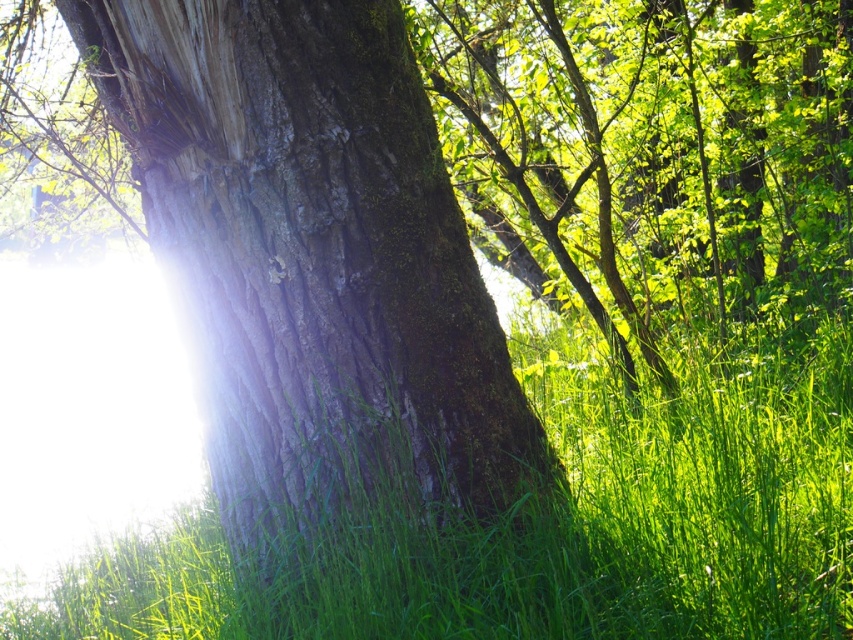
Looking at this image, does smooth bark tree trunk at center lie behind green grass at center?

Yes, it is.

Is smooth bark tree trunk at center positioned before green grass at center?

No, smooth bark tree trunk at center is further to the viewer.

Measure the distance between smooth bark tree trunk at center and camera.

smooth bark tree trunk at center and camera are 6.89 feet apart.

What are the coordinates of `smooth bark tree trunk at center` in the screenshot? It's located at (312, 259).